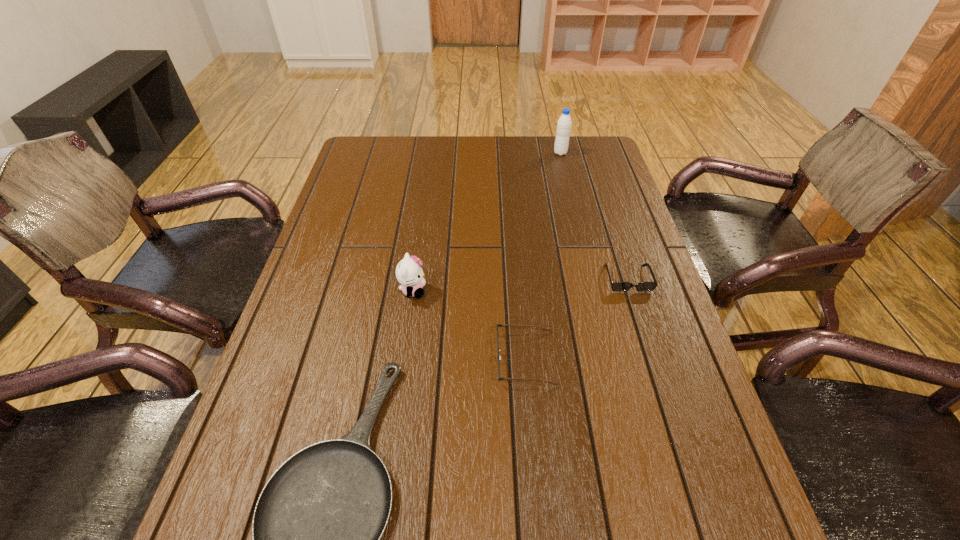
This screenshot has width=960, height=540. Find the location of `the farthest object`. the farthest object is located at coordinates (564, 123).

Find the location of a particular element. the tallest object is located at coordinates (564, 123).

The image size is (960, 540). In order to click on the second tallest object in this screenshot , I will do `click(409, 273)`.

The width and height of the screenshot is (960, 540). I want to click on the rightmost object, so click(617, 286).

You are a GUI agent. You are given a task and a screenshot of the screen. Output one action in this format:
    pyautogui.click(x=<x>, y=<y>)
    Task: Click on the spectacles
    Image resolution: width=960 pixels, height=540 pixels.
    Given the screenshot: What is the action you would take?
    pyautogui.click(x=503, y=325)

Locate an element on the screen. The height and width of the screenshot is (540, 960). blank space located 0.200m on the left of the tallest object is located at coordinates (497, 153).

The width and height of the screenshot is (960, 540). I want to click on free region located 0.260m on the front-facing side of the second tallest object, so click(530, 291).

Where is `free space located on the front-facing side of the sunglasses`? free space located on the front-facing side of the sunglasses is located at coordinates (639, 315).

Identify the location of vacant region located on the front-facing side of the third object from right to left. (333, 358).

Locate an element on the screen. Image resolution: width=960 pixels, height=540 pixels. free region located on the front-facing side of the third object from right to left is located at coordinates (406, 358).